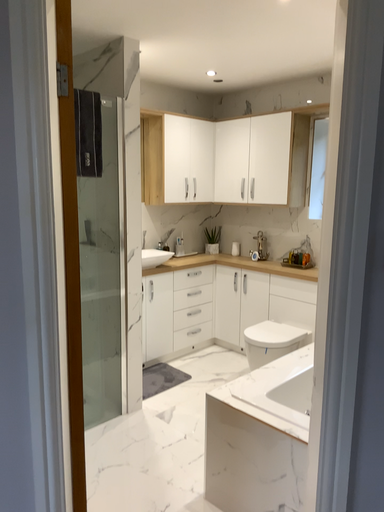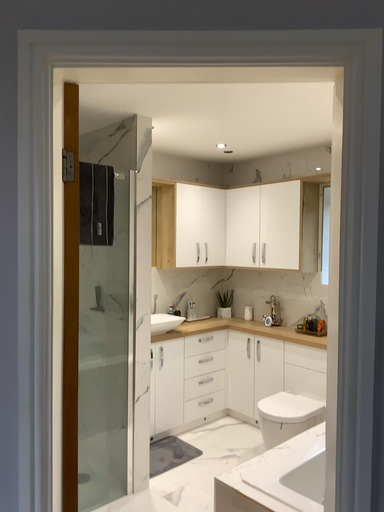
Question: Which way did the camera rotate in the video?

Choices:
 (A) rotated downward
 (B) rotated upward

Answer: (B)